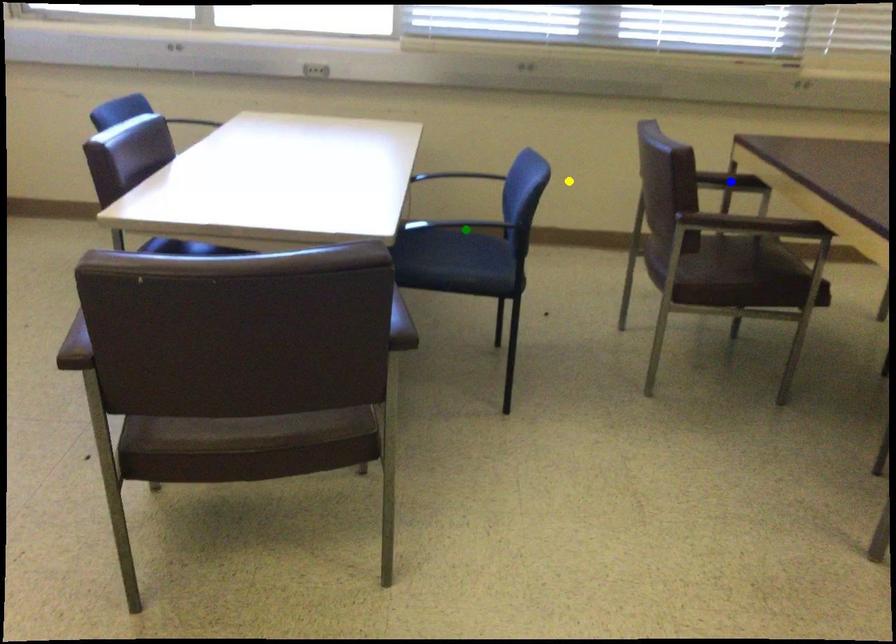
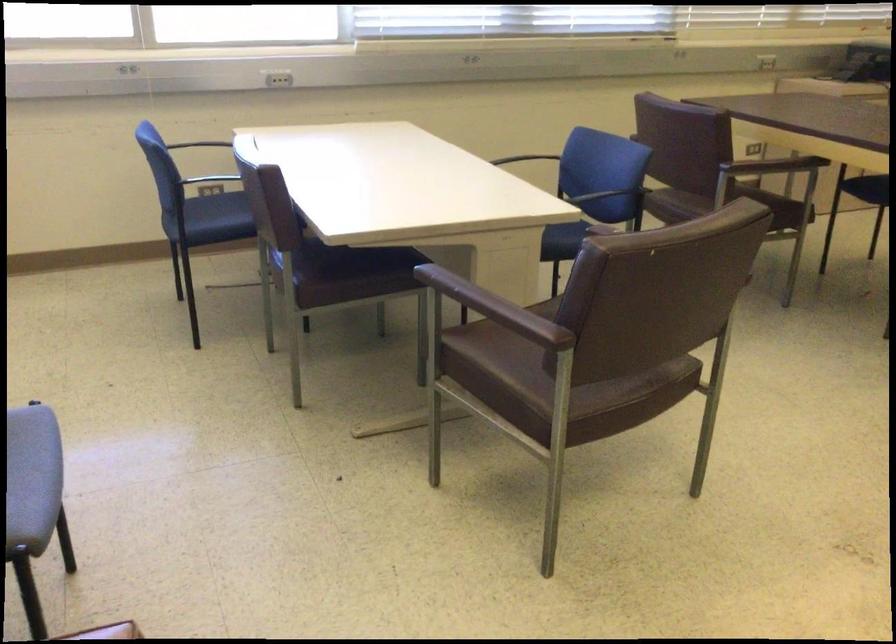
I am providing you with two images of the same scene from different viewpoints. Three points are marked in image1. Which point corresponds to a part or object that is occluded in image2?In image1, three points are marked. Which of them correspond to a part or object that is occluded in image2?Among the three points shown in image1, which one corresponds to a part or object that is no longer visible due to occlusion in image2?

blue point, green point